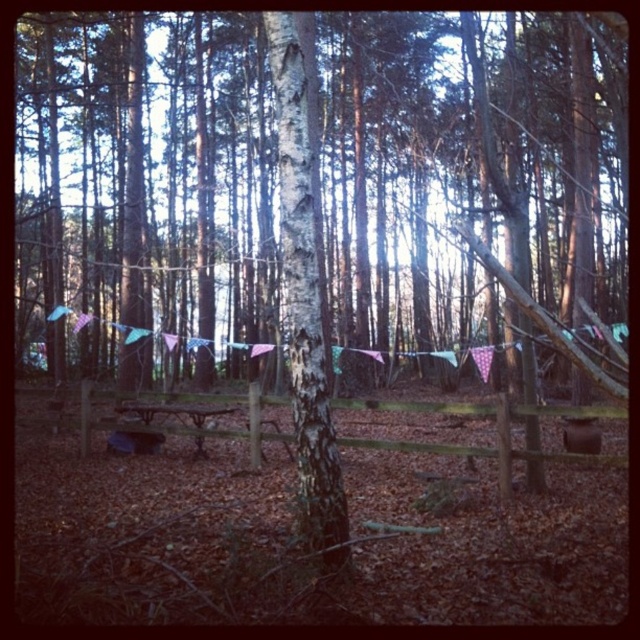
You are standing in the forest and see the white bark tree at center. If you want to take a photo of it, where should you position yourself relative to the tree to ensure it is centered in your camera frame?

To center the white bark tree at center in your camera frame, position yourself directly in front of it at its 2D location coordinates of approximately point (305,301).

You are planning to set up a small campfire in the center of the clearing where the white bark tree at center and wooden picnic table at center are located. Considering their sizes, which object would you need to move to make space for the fire pit?

The white bark tree at center has a smaller size compared to wooden picnic table at center. Therefore, you would need to move the white bark tree at center to make space for the campfire since it is smaller and easier to relocate.